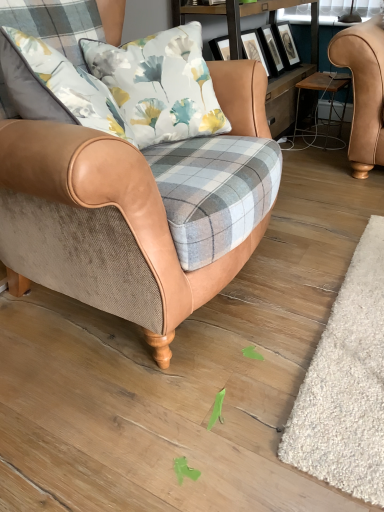
Question: Is tan leather armchair at center in contact with wooden framed artwork at upper center?

Choices:
 (A) no
 (B) yes

Answer: (A)

Question: Can you confirm if tan leather armchair at center is thinner than wooden framed artwork at upper center?

Choices:
 (A) yes
 (B) no

Answer: (B)

Question: Is tan leather armchair at center located outside wooden framed artwork at upper center?

Choices:
 (A) yes
 (B) no

Answer: (A)

Question: Is tan leather armchair at center behind wooden framed artwork at upper center?

Choices:
 (A) yes
 (B) no

Answer: (B)

Question: Is tan leather armchair at center oriented away from wooden framed artwork at upper center?

Choices:
 (A) no
 (B) yes

Answer: (A)

Question: Looking at their shapes, would you say wooden stool at right is wider or thinner than wooden framed artwork at upper center?

Choices:
 (A) thin
 (B) wide

Answer: (A)

Question: Is wooden stool at right bigger or smaller than wooden framed artwork at upper center?

Choices:
 (A) small
 (B) big

Answer: (A)

Question: Considering their positions, is wooden stool at right located in front of or behind wooden framed artwork at upper center?

Choices:
 (A) behind
 (B) front

Answer: (A)

Question: From a real-world perspective, is wooden stool at right positioned above or below wooden framed artwork at upper center?

Choices:
 (A) below
 (B) above

Answer: (A)

Question: Would you say wooden stool at right is inside or outside tan leather armchair at center?

Choices:
 (A) outside
 (B) inside

Answer: (A)

Question: Based on their sizes in the image, would you say wooden stool at right is bigger or smaller than tan leather armchair at center?

Choices:
 (A) small
 (B) big

Answer: (A)

Question: From the image's perspective, is wooden stool at right located above or below tan leather armchair at center?

Choices:
 (A) below
 (B) above

Answer: (B)

Question: Based on their positions, is wooden stool at right located to the left or right of tan leather armchair at center?

Choices:
 (A) left
 (B) right

Answer: (B)

Question: Is wooden framed artwork at upper center spatially inside white shaggy rug at lower right, or outside of it?

Choices:
 (A) inside
 (B) outside

Answer: (B)

Question: Looking at their shapes, would you say wooden framed artwork at upper center is wider or thinner than white shaggy rug at lower right?

Choices:
 (A) thin
 (B) wide

Answer: (A)